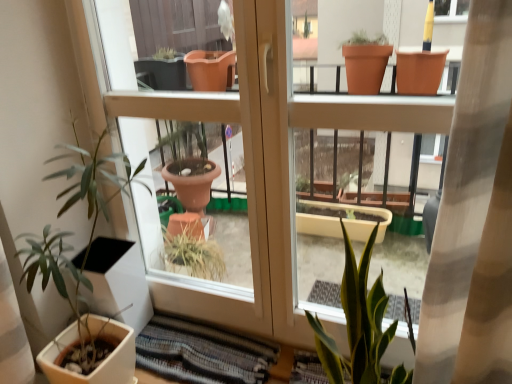
Question: Should I look upward or downward to see striped fabric rug at lower center?

Choices:
 (A) down
 (B) up

Answer: (A)

Question: Is green matte plant at left oriented away from matte brown screen door at lower left?

Choices:
 (A) yes
 (B) no

Answer: (A)

Question: Is the position of green matte plant at left more distant than that of matte brown screen door at lower left?

Choices:
 (A) yes
 (B) no

Answer: (B)

Question: From the image's perspective, is green matte plant at left on matte brown screen door at lower left?

Choices:
 (A) yes
 (B) no

Answer: (B)

Question: Is green matte plant at left far from matte brown screen door at lower left?

Choices:
 (A) no
 (B) yes

Answer: (A)

Question: Does green matte plant at left have a smaller size compared to matte brown screen door at lower left?

Choices:
 (A) no
 (B) yes

Answer: (A)

Question: Is green matte plant at left wider than matte brown screen door at lower left?

Choices:
 (A) no
 (B) yes

Answer: (B)

Question: Considering the relative sizes of matte brown screen door at lower left and striped fabric rug at lower center in the image provided, is matte brown screen door at lower left wider than striped fabric rug at lower center?

Choices:
 (A) yes
 (B) no

Answer: (B)

Question: Considering the relative sizes of matte brown screen door at lower left and striped fabric rug at lower center in the image provided, is matte brown screen door at lower left bigger than striped fabric rug at lower center?

Choices:
 (A) no
 (B) yes

Answer: (B)

Question: Is matte brown screen door at lower left thinner than striped fabric rug at lower center?

Choices:
 (A) yes
 (B) no

Answer: (A)

Question: Is striped fabric rug at lower center at the back of matte brown screen door at lower left?

Choices:
 (A) no
 (B) yes

Answer: (A)

Question: Is matte brown screen door at lower left oriented towards striped fabric rug at lower center?

Choices:
 (A) yes
 (B) no

Answer: (A)

Question: Considering the relative sizes of matte brown screen door at lower left and striped fabric rug at lower center in the image provided, is matte brown screen door at lower left taller than striped fabric rug at lower center?

Choices:
 (A) no
 (B) yes

Answer: (B)

Question: Does striped fabric rug at lower center appear on the right side of green matte plant at left?

Choices:
 (A) no
 (B) yes

Answer: (B)